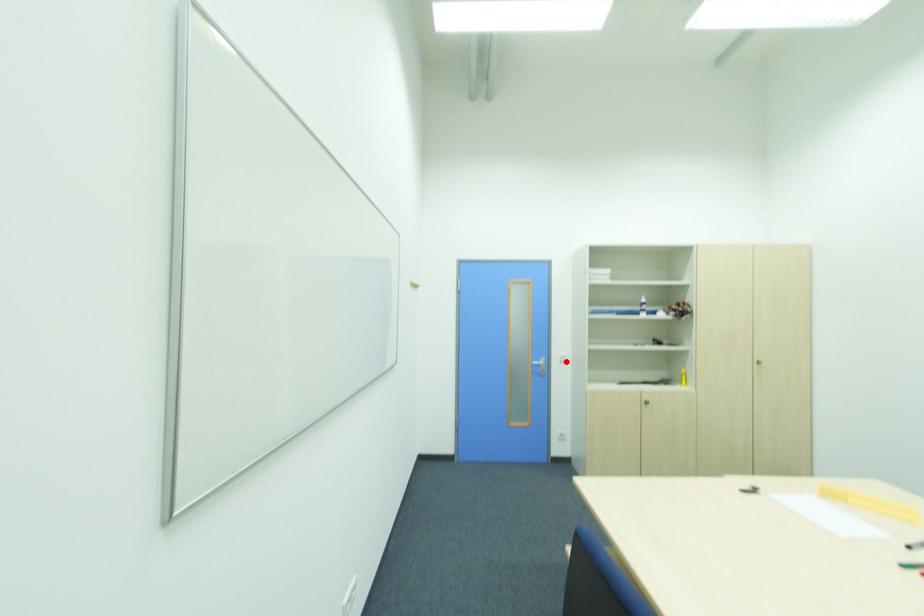
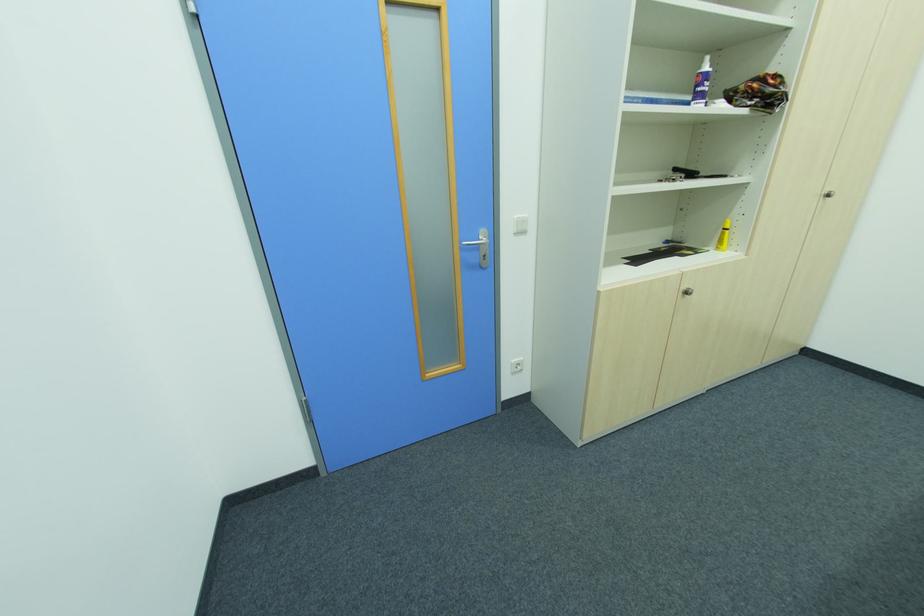
Question: I am providing you with two images of the same scene from different viewpoints. A red point is marked on the first image. At the location where the point appears in image 1, is it still visible in image 2?

Choices:
 (A) Yes
 (B) No

Answer: (A)